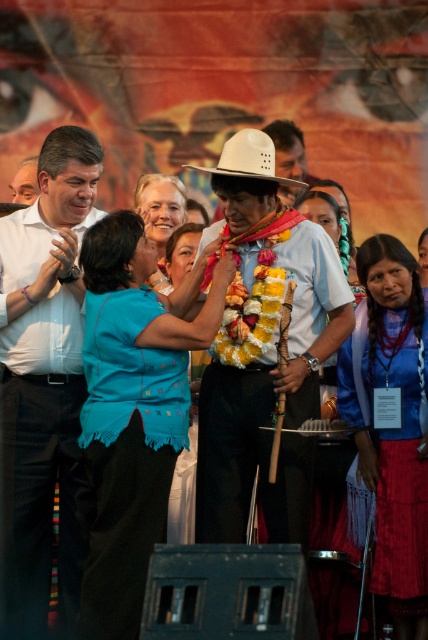
Question: Which is farther from the white matte cowboy hat at center?

Choices:
 (A) white shirt at left
 (B) white matte hat at center
 (C) matte white shirt at upper left
 (D) velvet blue blouse at center

Answer: (C)

Question: Based on their relative distances, which object is nearer to the white matte hat at center?

Choices:
 (A) velvet blue blouse at center
 (B) matte white shirt at center
 (C) matte white shirt at upper left
 (D) white shirt at left

Answer: (A)

Question: From the image, what is the correct spatial relationship of white matte hat at center in relation to white matte cowboy hat at center?

Choices:
 (A) right
 (B) left

Answer: (B)

Question: Is white shirt at left closer to the viewer compared to white matte cowboy hat at center?

Choices:
 (A) no
 (B) yes

Answer: (B)

Question: Which is farther from the white matte hat at center?

Choices:
 (A) matte white shirt at center
 (B) velvet blue blouse at center
 (C) white matte cowboy hat at center
 (D) white shirt at left

Answer: (C)

Question: Observing the image, what is the correct spatial positioning of white matte hat at center in reference to white shirt at left?

Choices:
 (A) below
 (B) above

Answer: (B)